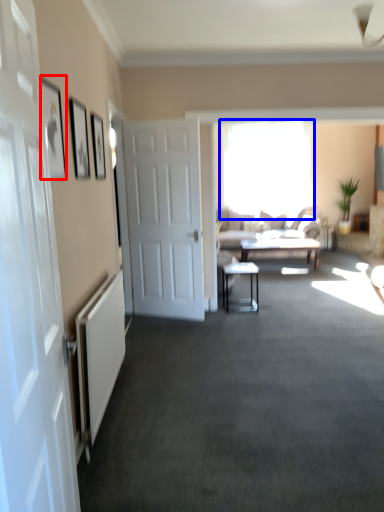
Question: Which object appears farthest to the camera in this image, picture frame (highlighted by a red box) or window (highlighted by a blue box)?

Choices:
 (A) picture frame
 (B) window

Answer: (B)